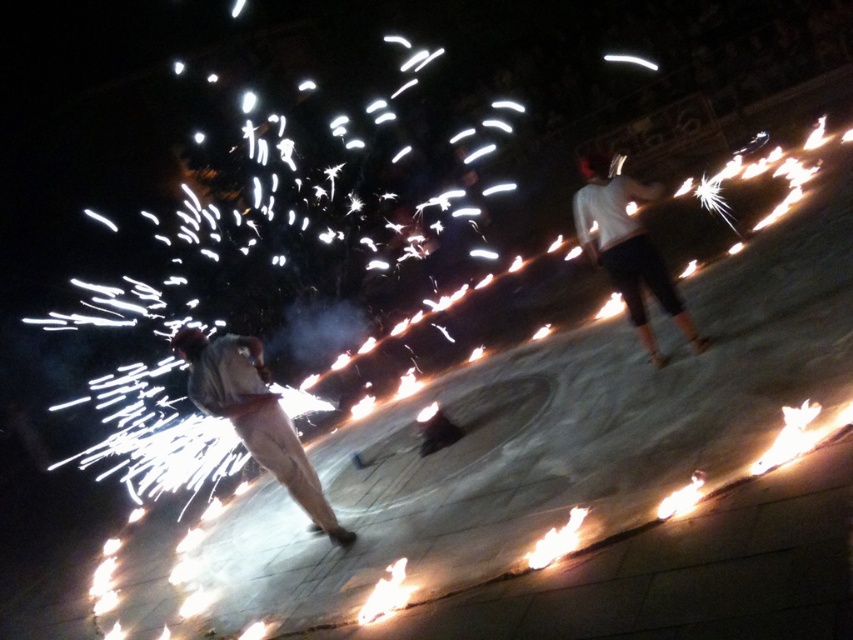
You are a photographer trying to capture the fire performance. You notice two performers wearing light brown fabric pants at center and white matte pants at center. Which performer is positioned to the left?

The light brown fabric pants at center is to the left of white matte pants at center, so the performer wearing light brown fabric pants at center is positioned to the left.

You are a photographer trying to capture the fire performance. You notice the light brown fabric pants at center in the midground. Based on their position, can you estimate whether they are closer to the front or the back of the scene?

The light brown fabric pants at center is located at point 0.652 on the x axis and 0.299 on the y axis. Since the y axis value is closer to 0, which typically represents the bottom of the image, this suggests the pants are positioned towards the lower part of the frame. In many compositions, lower positions often indicate closer proximity to the viewer, so the light brown fabric pants at center are likely closer to the front of the scene.